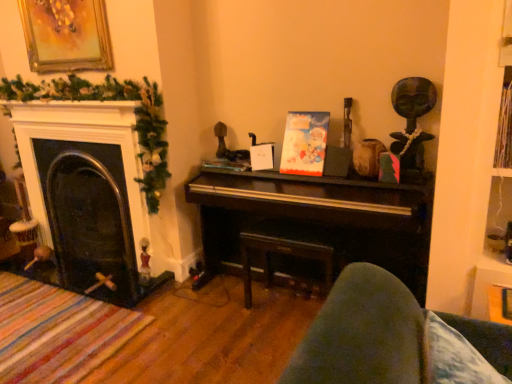
Question: From a real-world perspective, is black glass fireplace at left located higher than shiny dark wood piano at center?

Choices:
 (A) no
 (B) yes

Answer: (B)

Question: Is black glass fireplace at left directly adjacent to shiny dark wood piano at center?

Choices:
 (A) no
 (B) yes

Answer: (A)

Question: Can you confirm if black glass fireplace at left is wider than shiny dark wood piano at center?

Choices:
 (A) no
 (B) yes

Answer: (A)

Question: Does black glass fireplace at left turn towards shiny dark wood piano at center?

Choices:
 (A) no
 (B) yes

Answer: (A)

Question: Is black glass fireplace at left positioned with its back to shiny dark wood piano at center?

Choices:
 (A) yes
 (B) no

Answer: (B)

Question: Considering the positions of point (71, 56) and point (325, 359), is point (71, 56) closer or farther from the camera than point (325, 359)?

Choices:
 (A) closer
 (B) farther

Answer: (B)

Question: From the image's perspective, relative to velvet blue cushion at lower right, is gold-framed painting at upper left above or below?

Choices:
 (A) above
 (B) below

Answer: (A)

Question: In the image, is gold-framed painting at upper left positioned in front of or behind velvet blue cushion at lower right?

Choices:
 (A) front
 (B) behind

Answer: (B)

Question: Is gold-framed painting at upper left spatially inside velvet blue cushion at lower right, or outside of it?

Choices:
 (A) inside
 (B) outside

Answer: (B)

Question: Considering the relative positions of black glass fireplace at left and velvet blue cushion at lower right in the image provided, is black glass fireplace at left to the left or to the right of velvet blue cushion at lower right?

Choices:
 (A) right
 (B) left

Answer: (B)

Question: In the image, is black glass fireplace at left positioned in front of or behind velvet blue cushion at lower right?

Choices:
 (A) front
 (B) behind

Answer: (B)

Question: From the image's perspective, is black glass fireplace at left above or below velvet blue cushion at lower right?

Choices:
 (A) above
 (B) below

Answer: (A)

Question: Is point (118, 182) positioned closer to the camera than point (457, 355)?

Choices:
 (A) farther
 (B) closer

Answer: (A)

Question: From a real-world perspective, is dark wood table at center positioned above or below gold-framed painting at upper left?

Choices:
 (A) below
 (B) above

Answer: (A)

Question: In terms of width, does dark wood table at center look wider or thinner when compared to gold-framed painting at upper left?

Choices:
 (A) wide
 (B) thin

Answer: (A)